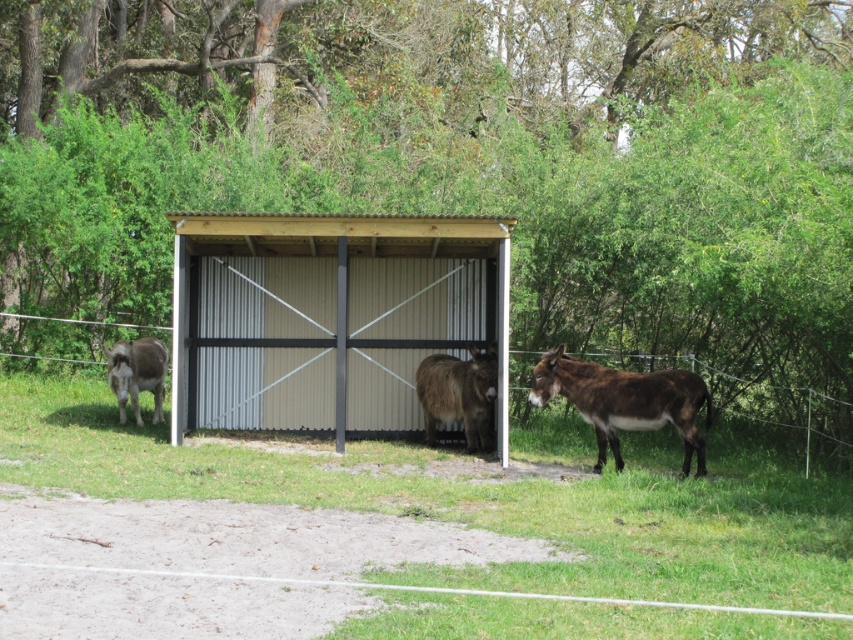
This screenshot has width=853, height=640. Describe the element at coordinates (625, 401) in the screenshot. I see `brown fuzzy mule at right` at that location.

Which is behind, point (595, 380) or point (16, 314)?

The point (16, 314) is behind.

Does point (614, 420) lie in front of point (175, 440)?

Yes, it is in front of point (175, 440).

The width and height of the screenshot is (853, 640). In order to click on brown fuzzy mule at right in this screenshot , I will do `click(625, 401)`.

How distant is green grass at center from metal wire fence at center?

6.54 feet

Between green grass at center and metal wire fence at center, which one has more height?

metal wire fence at center is taller.

Which is in front, point (718, 636) or point (810, 426)?

Positioned in front is point (718, 636).

Find the location of a particular element. The height and width of the screenshot is (640, 853). green grass at center is located at coordinates (486, 497).

Is brown fuzzy mule at right to the left of brown fuzzy donkey at left from the viewer's perspective?

Incorrect, brown fuzzy mule at right is not on the left side of brown fuzzy donkey at left.

Does brown fuzzy mule at right appear over brown fuzzy donkey at left?

Actually, brown fuzzy mule at right is below brown fuzzy donkey at left.

This screenshot has width=853, height=640. In order to click on brown fuzzy mule at right in this screenshot , I will do `click(625, 401)`.